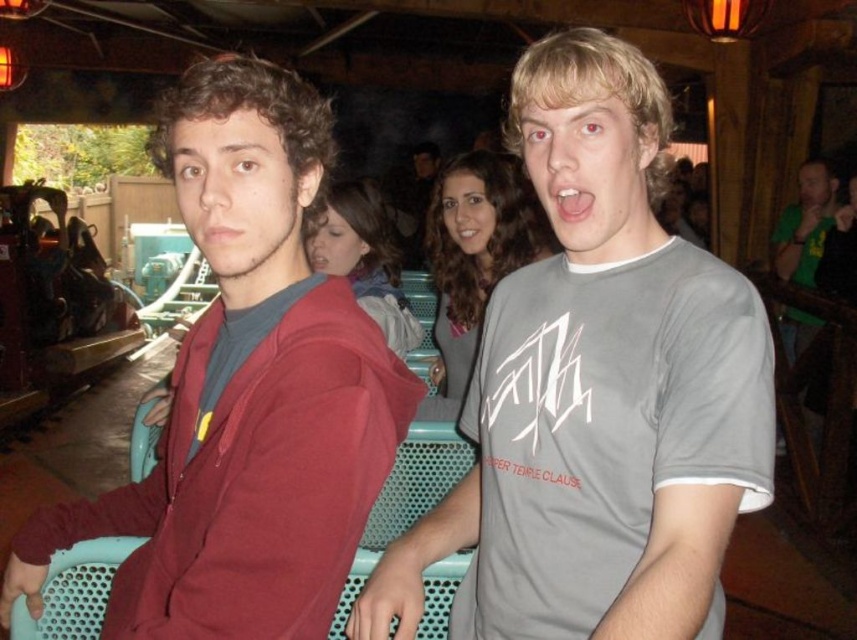
Can you confirm if gray matte t-shirt at center is thinner than matte red hoodie at left?

Yes, gray matte t-shirt at center is thinner than matte red hoodie at left.

Does gray matte t-shirt at center have a smaller size compared to matte red hoodie at left?

Yes, gray matte t-shirt at center is smaller than matte red hoodie at left.

Who is more distant from viewer, (616, 547) or (196, 548)?

Positioned behind is point (196, 548).

Identify the location of gray matte t-shirt at center. This screenshot has width=857, height=640. (597, 392).

Which is more to the right, gray matte t-shirt at center or green matte shirt at right?

From the viewer's perspective, green matte shirt at right appears more on the right side.

Does gray matte t-shirt at center have a lesser width compared to green matte shirt at right?

Correct, gray matte t-shirt at center's width is less than green matte shirt at right's.

Is point (483, 506) closer to viewer compared to point (792, 321)?

Yes, it is in front of point (792, 321).

The image size is (857, 640). I want to click on gray matte t-shirt at center, so click(597, 392).

Between point (243, 362) and point (783, 328), which one is positioned behind?

Point (783, 328)

Which is more to the right, matte red hoodie at left or green matte shirt at right?

From the viewer's perspective, green matte shirt at right appears more on the right side.

Between point (403, 403) and point (818, 212), which one is positioned behind?

The point (818, 212) is behind.

In order to click on matte red hoodie at left in this screenshot , I will do `click(246, 392)`.